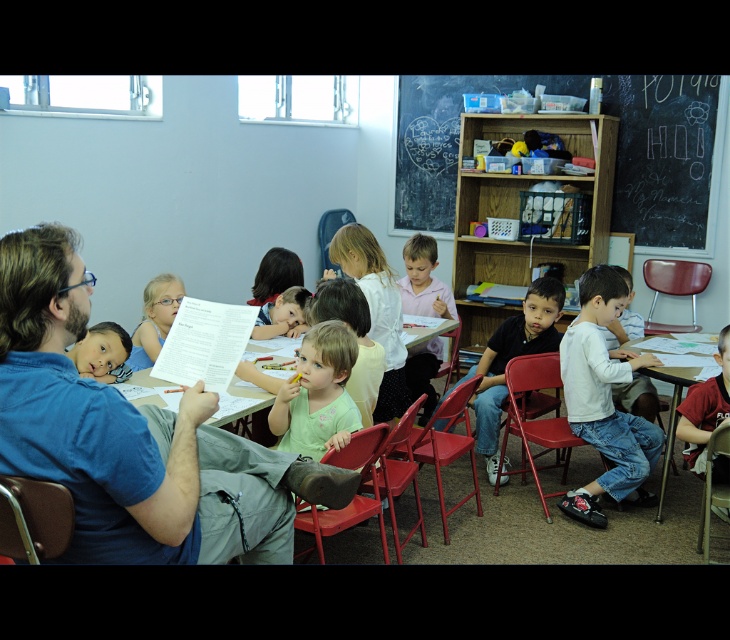
You are a teacher in a classroom and want to hand out a new worksheet to all students. The red shirt at lower right and the smooth skin child at center are two students in the class. If you are standing at the front of the classroom, which student is closer to you?

The smooth skin child at center is closer to you because the distance between the red shirt at lower right and the smooth skin child at center is 6.82 feet, implying the smooth skin child is nearer to the front.

You are a student in the classroom and you need to hand in your homework to the teacher. The teacher is wearing the white matte shirt at center and the pink matte shirt at center. Which shirt should you approach to submit your homework?

You should approach the white matte shirt at center because it is the teacher wearing that shirt, while the pink matte shirt at center is another person. However, according to the objects description, the white matte shirt at center is to the right of the pink matte shirt at center, so the teacher is located to the right side.